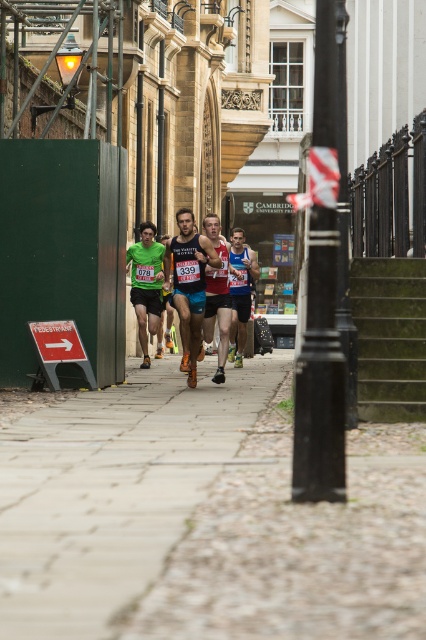
Question: Among these objects, which one is farthest from the camera?

Choices:
 (A) green fabric runner at center
 (B) reddish-brown fabric running at center

Answer: (A)

Question: Based on their relative distances, which object is farther from the green fabric runner at center?

Choices:
 (A) concrete paving at center
 (B) blue fabric running suit at center

Answer: (A)

Question: Which point appears closest to the camera in this image?

Choices:
 (A) (169, 248)
 (B) (216, 372)
 (C) (54, 477)
 (D) (249, 298)

Answer: (C)

Question: Can you confirm if concrete paving at center is wider than green metal stairs at center?

Choices:
 (A) yes
 (B) no

Answer: (A)

Question: Does concrete paving at center have a smaller size compared to blue fabric running suit at center?

Choices:
 (A) yes
 (B) no

Answer: (B)

Question: Is reddish-brown fabric running at center wider than blue fabric running suit at center?

Choices:
 (A) yes
 (B) no

Answer: (A)